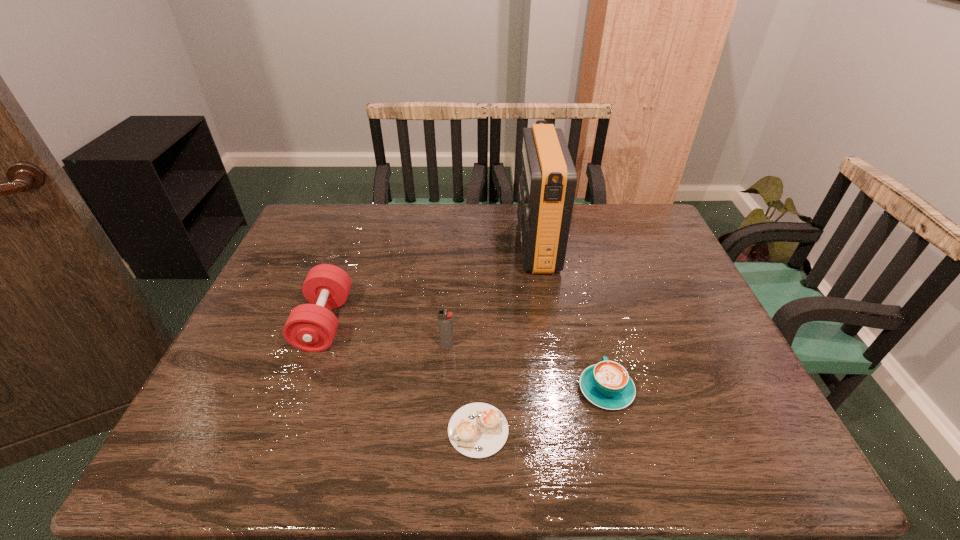
Locate an element on the screen. The width and height of the screenshot is (960, 540). radio receiver is located at coordinates (547, 185).

I want to click on the tallest object, so click(x=547, y=185).

Where is `igniter`? igniter is located at coordinates (445, 320).

Image resolution: width=960 pixels, height=540 pixels. I want to click on dumbbell, so click(312, 327).

The image size is (960, 540). Identify the location of the right cappuccino. (606, 384).

You are a GUI agent. You are given a task and a screenshot of the screen. Output one action in this format:
    pyautogui.click(x=<x>, y=<y>)
    Task: Click on the fourth tallest object
    The width and height of the screenshot is (960, 540).
    Given the screenshot: What is the action you would take?
    pyautogui.click(x=606, y=384)

At what (x,y) coordinates should I click in order to perform the action: click on the left cappuccino. Please return your answer as a coordinate pair (x, y). Looking at the image, I should click on (477, 430).

Where is `the shorter cappuccino`? the shorter cappuccino is located at coordinates (477, 430).

Where is `vacant region located on the front-facing side of the farthest object`? Image resolution: width=960 pixels, height=540 pixels. vacant region located on the front-facing side of the farthest object is located at coordinates click(x=462, y=245).

The height and width of the screenshot is (540, 960). I want to click on blank space located 0.360m on the front-facing side of the farthest object, so click(x=405, y=245).